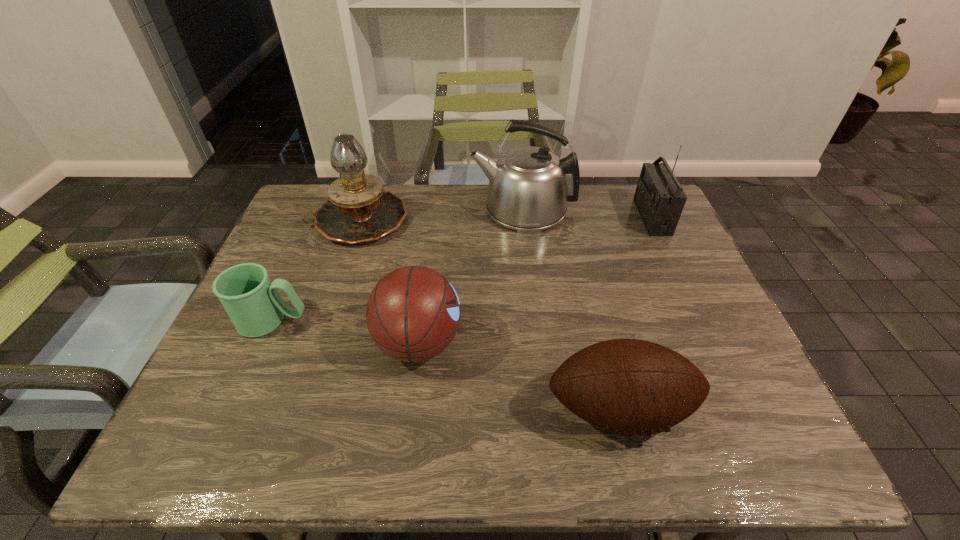
Where is `kettle`? kettle is located at coordinates (529, 187).

You are a GUI agent. You are given a task and a screenshot of the screen. Output one action in this format:
    pyautogui.click(x=<x>, y=<y>)
    Task: Click on the rightmost object
    The height and width of the screenshot is (540, 960).
    Given the screenshot: What is the action you would take?
    pyautogui.click(x=659, y=197)

This screenshot has width=960, height=540. I want to click on oil lamp, so point(359,210).

Find the location of a particular element. The width and height of the screenshot is (960, 540). basketball is located at coordinates (413, 313).

Locate an element on the screen. The width and height of the screenshot is (960, 540). football is located at coordinates (627, 386).

Locate an element on the screen. mug is located at coordinates (252, 302).

Where is `vacant space located on the spout of the kettle`? The width and height of the screenshot is (960, 540). vacant space located on the spout of the kettle is located at coordinates (372, 210).

Locate an element on the screen. This screenshot has width=960, height=540. blank space located on the spout of the kettle is located at coordinates (379, 210).

Image resolution: width=960 pixels, height=540 pixels. I want to click on vacant area situated on the spout of the kettle, so click(x=360, y=210).

At what (x,y) coordinates should I click in order to perform the action: click on free space located on the front panel of the rightmost object. Please return your answer as a coordinate pair (x, y). Image resolution: width=960 pixels, height=540 pixels. Looking at the image, I should click on (569, 217).